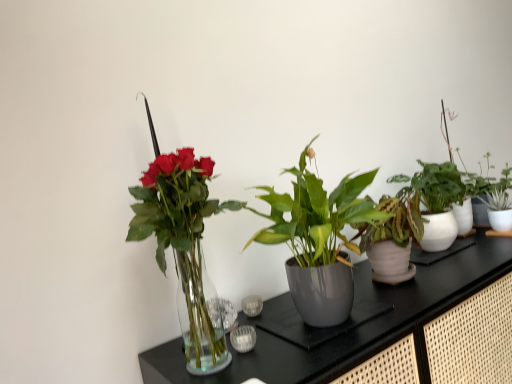
The width and height of the screenshot is (512, 384). I want to click on glossy ceramic plant pot at center, marked as the second houseplant in a left-to-right arrangement, so click(344, 323).

Is glossy ceramic plant pot at center, the 3th houseplant when ordered from right to left, to the right of white ceramic pot at upper right, the 3th houseplant when ordered from left to right, from the viewer's perspective?

No, glossy ceramic plant pot at center, the 3th houseplant when ordered from right to left, is not to the right of white ceramic pot at upper right, the 3th houseplant when ordered from left to right.

Does glossy ceramic plant pot at center, marked as the second houseplant in a left-to-right arrangement, have a greater height compared to white ceramic pot at upper right, the 3th houseplant when ordered from left to right?

Incorrect, the height of glossy ceramic plant pot at center, marked as the second houseplant in a left-to-right arrangement, is not larger of that of white ceramic pot at upper right, the 3th houseplant when ordered from left to right.

From the image's perspective, does glossy ceramic plant pot at center, marked as the second houseplant in a left-to-right arrangement, appear higher than white ceramic pot at upper right, the 3th houseplant when ordered from left to right?

Incorrect, from the image's perspective, glossy ceramic plant pot at center, marked as the second houseplant in a left-to-right arrangement, is lower than white ceramic pot at upper right, the 3th houseplant when ordered from left to right.

Between glossy ceramic plant pot at center, marked as the second houseplant in a left-to-right arrangement, and white ceramic pot at upper right, the 3th houseplant when ordered from left to right, which one is positioned behind?

white ceramic pot at upper right, the 3th houseplant when ordered from left to right, is further away from the camera.

From a real-world perspective, is white glossy pot at right, acting as the 4th houseplant starting from the left, above or below white ceramic pot at upper right, which ranks as the second houseplant in right-to-left order?

white glossy pot at right, acting as the 4th houseplant starting from the left, is situated lower than white ceramic pot at upper right, which ranks as the second houseplant in right-to-left order, in the real world.

Would you say white ceramic pot at upper right, which ranks as the second houseplant in right-to-left order, is part of white glossy pot at right, acting as the 4th houseplant starting from the left,'s contents?

No, white glossy pot at right, acting as the 4th houseplant starting from the left, does not contain white ceramic pot at upper right, which ranks as the second houseplant in right-to-left order.

Considering the relative sizes of white glossy pot at right, which is counted as the 1th houseplant, starting from the right, and white ceramic pot at upper right, which ranks as the second houseplant in right-to-left order, in the image provided, is white glossy pot at right, which is counted as the 1th houseplant, starting from the right, shorter than white ceramic pot at upper right, which ranks as the second houseplant in right-to-left order,?

Correct, white glossy pot at right, which is counted as the 1th houseplant, starting from the right, is not as tall as white ceramic pot at upper right, which ranks as the second houseplant in right-to-left order.

Considering the positions of objects transparent glass vase at left and white glossy pot at right, acting as the 4th houseplant starting from the left, in the image provided, who is more to the left, transparent glass vase at left or white glossy pot at right, acting as the 4th houseplant starting from the left,?

From the viewer's perspective, transparent glass vase at left appears more on the left side.

Between transparent glass vase at left and white glossy pot at right, acting as the 4th houseplant starting from the left, which one has larger width?

transparent glass vase at left.

Does transparent glass vase at left have a larger size compared to white glossy pot at right, acting as the 4th houseplant starting from the left?

Indeed, transparent glass vase at left has a larger size compared to white glossy pot at right, acting as the 4th houseplant starting from the left.

In the scene shown: Does transparent glass vase at left turn towards white glossy pot at right, which is counted as the 1th houseplant, starting from the right?

No, transparent glass vase at left is not turned towards white glossy pot at right, which is counted as the 1th houseplant, starting from the right.

From the image's perspective, is green glossy plant at center, placed as the fourth houseplant when sorted from right to left, on glossy ceramic plant pot at center, marked as the second houseplant in a left-to-right arrangement?

No, from the image's perspective, green glossy plant at center, placed as the fourth houseplant when sorted from right to left, is not on top of glossy ceramic plant pot at center, marked as the second houseplant in a left-to-right arrangement.

Is green glossy plant at center, placed as the fourth houseplant when sorted from right to left, positioned with its back to glossy ceramic plant pot at center, marked as the second houseplant in a left-to-right arrangement?

No, glossy ceramic plant pot at center, marked as the second houseplant in a left-to-right arrangement, is not at the back of green glossy plant at center, placed as the fourth houseplant when sorted from right to left.

Is green glossy plant at center, placed as the fourth houseplant when sorted from right to left, next to glossy ceramic plant pot at center, the 3th houseplant when ordered from right to left?

green glossy plant at center, placed as the fourth houseplant when sorted from right to left, is not next to glossy ceramic plant pot at center, the 3th houseplant when ordered from right to left, and they're not touching.

Is green glossy plant at center, placed as the fourth houseplant when sorted from right to left, situated inside glossy ceramic plant pot at center, marked as the second houseplant in a left-to-right arrangement, or outside?

Answer: green glossy plant at center, placed as the fourth houseplant when sorted from right to left, cannot be found inside glossy ceramic plant pot at center, marked as the second houseplant in a left-to-right arrangement.

From the picture: From a real-world perspective, is white ceramic pot at upper right, the 3th houseplant when ordered from left to right, beneath white glossy pot at right, which is counted as the 1th houseplant, starting from the right?

Incorrect, from a real-world perspective, white ceramic pot at upper right, the 3th houseplant when ordered from left to right, is higher than white glossy pot at right, which is counted as the 1th houseplant, starting from the right.

Does white ceramic pot at upper right, which ranks as the second houseplant in right-to-left order, have a smaller size compared to white glossy pot at right, which is counted as the 1th houseplant, starting from the right?

No.

Who is more distant, white ceramic pot at upper right, which ranks as the second houseplant in right-to-left order, or white glossy pot at right, which is counted as the 1th houseplant, starting from the right?

white ceramic pot at upper right, which ranks as the second houseplant in right-to-left order, is more distant.

Does point (450, 230) come in front of point (502, 205)?

That is True.

Between transparent glass vase at left and green glossy plant at center, marked as the 1th houseplant in a left-to-right arrangement, which one has less height?

With less height is green glossy plant at center, marked as the 1th houseplant in a left-to-right arrangement.

Which object is positioned more to the left, transparent glass vase at left or green glossy plant at center, marked as the 1th houseplant in a left-to-right arrangement?

From the viewer's perspective, green glossy plant at center, marked as the 1th houseplant in a left-to-right arrangement, appears more on the left side.

In the scene shown: Looking at their sizes, would you say transparent glass vase at left is wider or thinner than green glossy plant at center, placed as the fourth houseplant when sorted from right to left?

transparent glass vase at left is wider than green glossy plant at center, placed as the fourth houseplant when sorted from right to left.

Is point (261, 345) farther from viewer compared to point (170, 229)?

Yes.

You are a GUI agent. You are given a task and a screenshot of the screen. Output one action in this format:
    pyautogui.click(x=<x>, y=<y>)
    Task: Click on the 2nd houseplant to the left of the white ceramic pot at upper right, the 3th houseplant when ordered from left to right, starting your count from the anchor
    
    Given the screenshot: What is the action you would take?
    pyautogui.click(x=184, y=245)

From a real-world perspective, which object stands above the other?

From a 3D spatial view, white ceramic pot at upper right, which ranks as the second houseplant in right-to-left order, is above.

Does point (419, 185) appear closer or farther from the camera than point (212, 209)?

Clearly, point (419, 185) is more distant from the camera than point (212, 209).

Which houseplant is the 1st one when counting from the left side of the white ceramic pot at upper right, the 3th houseplant when ordered from left to right? Please provide its 2D coordinates.

[(344, 323)]

At what (x,y) coordinates should I click in order to perform the action: click on houseplant on the right of white ceramic pot at upper right, which ranks as the second houseplant in right-to-left order. Please return your answer as a coordinate pair (x, y). Looking at the image, I should click on (495, 197).

Based on their spatial positions, is white ceramic pot at upper right, which ranks as the second houseplant in right-to-left order, or green glossy plant at center, placed as the fourth houseplant when sorted from right to left, closer to glossy ceramic plant pot at center, marked as the second houseplant in a left-to-right arrangement?

Based on the image, green glossy plant at center, placed as the fourth houseplant when sorted from right to left, appears to be nearer to glossy ceramic plant pot at center, marked as the second houseplant in a left-to-right arrangement.

Estimate the real-world distances between objects in this image. Which object is further from green glossy plant at center, placed as the fourth houseplant when sorted from right to left, white glossy pot at right, acting as the 4th houseplant starting from the left, or glossy ceramic plant pot at center, marked as the second houseplant in a left-to-right arrangement?

Based on the image, white glossy pot at right, acting as the 4th houseplant starting from the left, appears to be further to green glossy plant at center, placed as the fourth houseplant when sorted from right to left.

When comparing their distances from transparent glass vase at left, does white ceramic pot at upper right, which ranks as the second houseplant in right-to-left order, or green glossy plant at center, placed as the fourth houseplant when sorted from right to left, seem further?

green glossy plant at center, placed as the fourth houseplant when sorted from right to left, is positioned further to the anchor transparent glass vase at left.

Looking at the image, which one is located closer to white ceramic pot at upper right, the 3th houseplant when ordered from left to right, transparent glass vase at left or glossy ceramic plant pot at center, the 3th houseplant when ordered from right to left?

transparent glass vase at left lies closer to white ceramic pot at upper right, the 3th houseplant when ordered from left to right, than the other object.

When comparing their distances from green glossy plant at center, marked as the 1th houseplant in a left-to-right arrangement, does transparent glass vase at left or white ceramic pot at upper right, which ranks as the second houseplant in right-to-left order, seem further?

The object further to green glossy plant at center, marked as the 1th houseplant in a left-to-right arrangement, is white ceramic pot at upper right, which ranks as the second houseplant in right-to-left order.

Which object lies nearer to the anchor point green glossy plant at center, marked as the 1th houseplant in a left-to-right arrangement, transparent glass vase at left or glossy ceramic plant pot at center, the 3th houseplant when ordered from right to left?

Based on the image, glossy ceramic plant pot at center, the 3th houseplant when ordered from right to left, appears to be nearer to green glossy plant at center, marked as the 1th houseplant in a left-to-right arrangement.

Considering their positions, is green glossy plant at center, placed as the fourth houseplant when sorted from right to left, positioned closer to white ceramic pot at upper right, which ranks as the second houseplant in right-to-left order, than white glossy pot at right, which is counted as the 1th houseplant, starting from the right?

white glossy pot at right, which is counted as the 1th houseplant, starting from the right, is closer to white ceramic pot at upper right, which ranks as the second houseplant in right-to-left order.

Estimate the real-world distances between objects in this image. Which object is closer to white ceramic pot at upper right, the 3th houseplant when ordered from left to right, white glossy pot at right, which is counted as the 1th houseplant, starting from the right, or green glossy plant at center, placed as the fourth houseplant when sorted from right to left?

Among the two, white glossy pot at right, which is counted as the 1th houseplant, starting from the right, is located nearer to white ceramic pot at upper right, the 3th houseplant when ordered from left to right.

Image resolution: width=512 pixels, height=384 pixels. I want to click on counter between green glossy plant at center, placed as the fourth houseplant when sorted from right to left, and white ceramic pot at upper right, which ranks as the second houseplant in right-to-left order, in the horizontal direction, so click(x=377, y=330).

The height and width of the screenshot is (384, 512). I want to click on houseplant located between green glossy plant at center, marked as the 1th houseplant in a left-to-right arrangement, and transparent glass vase at left in the left-right direction, so click(344, 323).

This screenshot has width=512, height=384. Identify the location of counter between green glossy plant at center, placed as the fourth houseplant when sorted from right to left, and white glossy pot at right, which is counted as the 1th houseplant, starting from the right, in the horizontal direction. (377, 330).

Find the location of a particular element. houseplant between green glossy plant at center, placed as the fourth houseplant when sorted from right to left, and white ceramic pot at upper right, the 3th houseplant when ordered from left to right, in the horizontal direction is located at coordinates (344, 323).